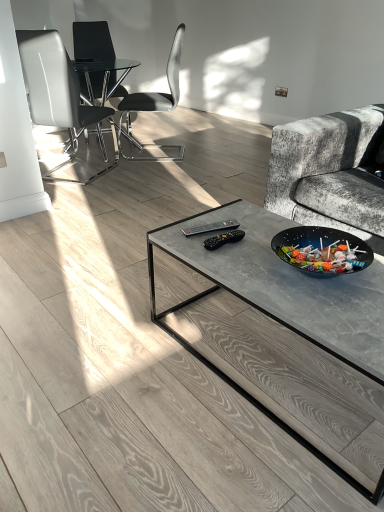
Question: Can you confirm if black plastic chair at center, which appears as the second chair when viewed from the back, is positioned to the right of black glass chair at upper left, which is counted as the third chair, starting from the front?

Choices:
 (A) yes
 (B) no

Answer: (A)

Question: Is black plastic chair at center, which appears as the second chair when viewed from the back, wider than black glass chair at upper left, arranged as the first chair when viewed from the back?

Choices:
 (A) no
 (B) yes

Answer: (B)

Question: From the image's perspective, is black plastic chair at center, which appears as the second chair when viewed from the back, under black glass chair at upper left, arranged as the first chair when viewed from the back?

Choices:
 (A) yes
 (B) no

Answer: (A)

Question: Is black plastic chair at center, which is the second chair from front to back, aimed at black glass chair at upper left, arranged as the first chair when viewed from the back?

Choices:
 (A) yes
 (B) no

Answer: (B)

Question: Is black plastic chair at center, which appears as the second chair when viewed from the back, not close to black glass chair at upper left, arranged as the first chair when viewed from the back?

Choices:
 (A) no
 (B) yes

Answer: (B)

Question: Does black plastic chair at center, which is the second chair from front to back, have a lesser height compared to black glass chair at upper left, which is counted as the third chair, starting from the front?

Choices:
 (A) yes
 (B) no

Answer: (A)

Question: Is white leather chair at left, which is the 3th chair in back-to-front order, not near black plastic chair at center, which appears as the second chair when viewed from the back?

Choices:
 (A) yes
 (B) no

Answer: (A)

Question: Considering the relative sizes of white leather chair at left, acting as the first chair starting from the front, and black plastic chair at center, which appears as the second chair when viewed from the back, in the image provided, is white leather chair at left, acting as the first chair starting from the front, wider than black plastic chair at center, which appears as the second chair when viewed from the back,?

Choices:
 (A) no
 (B) yes

Answer: (A)

Question: From the image's perspective, is white leather chair at left, which is the 3th chair in back-to-front order, below black plastic chair at center, which is the second chair from front to back?

Choices:
 (A) no
 (B) yes

Answer: (B)

Question: From a real-world perspective, is white leather chair at left, acting as the first chair starting from the front, below black plastic chair at center, which is the second chair from front to back?

Choices:
 (A) no
 (B) yes

Answer: (B)

Question: Does white leather chair at left, which is the 3th chair in back-to-front order, have a lesser height compared to black plastic chair at center, which is the second chair from front to back?

Choices:
 (A) no
 (B) yes

Answer: (A)

Question: Is the depth of white leather chair at left, acting as the first chair starting from the front, greater than that of black plastic chair at center, which is the second chair from front to back?

Choices:
 (A) no
 (B) yes

Answer: (A)

Question: Considering the relative sizes of white leather chair at left, which is the 3th chair in back-to-front order, and black glass chair at upper left, arranged as the first chair when viewed from the back, in the image provided, is white leather chair at left, which is the 3th chair in back-to-front order, wider than black glass chair at upper left, arranged as the first chair when viewed from the back,?

Choices:
 (A) yes
 (B) no

Answer: (A)